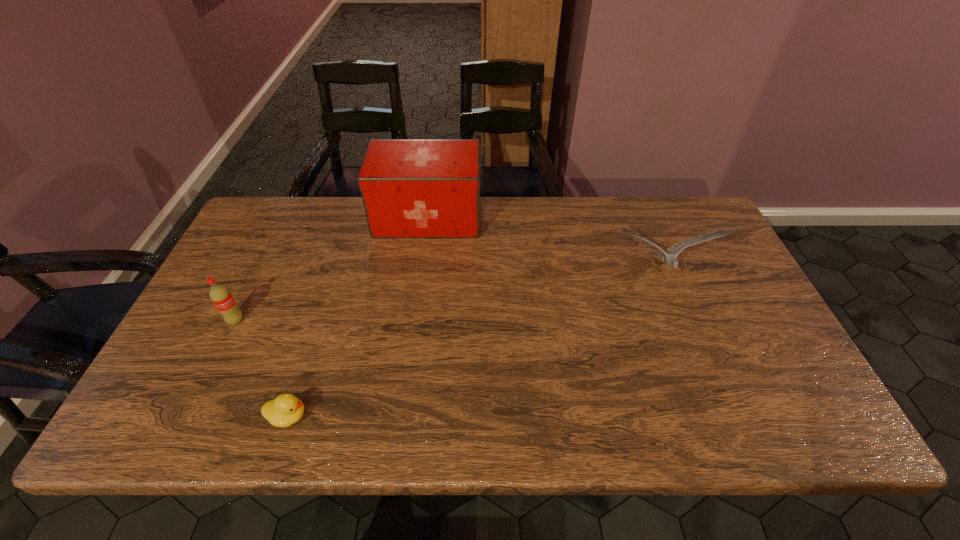
At what (x,y) coordinates should I click in order to perform the action: click on the second object from right to left. Please return your answer as a coordinate pair (x, y). The image size is (960, 540). Looking at the image, I should click on (410, 188).

What are the coordinates of `the farthest object` in the screenshot? It's located at (410, 188).

Identify the location of the third nearest object. This screenshot has width=960, height=540. (670, 259).

This screenshot has width=960, height=540. What are the coordinates of `gull` in the screenshot? It's located at (670, 259).

Identify the location of the leftmost object. tap(220, 296).

The image size is (960, 540). I want to click on the third farthest object, so click(x=220, y=296).

You are a GUI agent. You are given a task and a screenshot of the screen. Output one action in this format:
    pyautogui.click(x=<x>, y=<y>)
    Task: Click on the second object from left to right
    The image size is (960, 540).
    Given the screenshot: What is the action you would take?
    pyautogui.click(x=286, y=409)

Locate an element on the screen. the nearest object is located at coordinates (286, 409).

The width and height of the screenshot is (960, 540). What are the coordinates of `vacant space located 0.210m on the handle side of the tallest object` in the screenshot? It's located at (546, 218).

This screenshot has height=540, width=960. I want to click on vacant area located at the tip of the beak of the rightmost object, so click(703, 375).